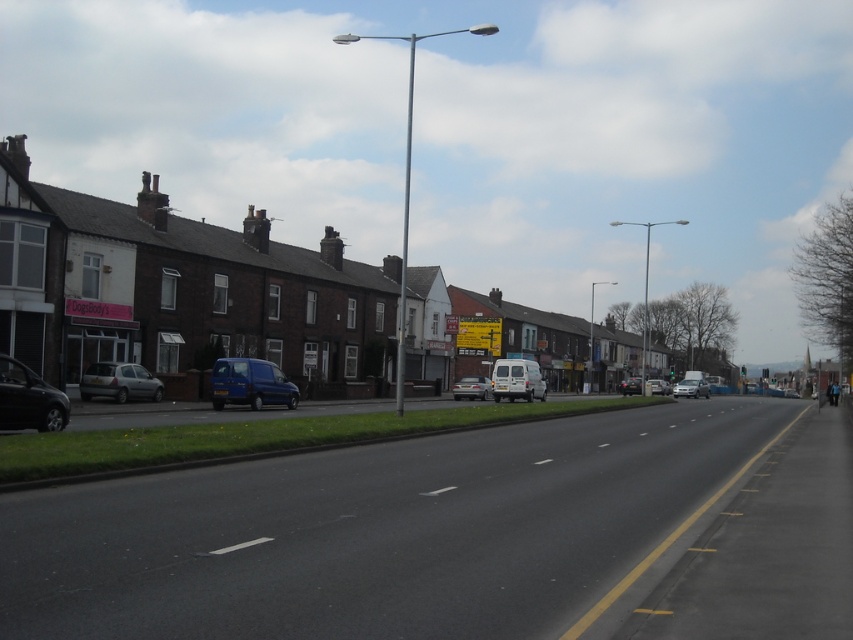
You are a drone operator trying to capture aerial footage of the street scene. You need to ensure that both the point at coordinates point (508, 376) and the point at coordinates point (654, 390) are in focus. Which point should you focus on first to ensure the depth of field captures both points effectively?

You should focus on point (508, 376) first because it is closer to the camera, allowing the depth of field to extend to the farther point (654, 390). This ensures both points are in focus.

You are standing at the center of the road in the image. Which direction should you walk to reach the metallic blue van at lower left?

You should walk towards the lower left direction to reach the metallic blue van at lower left.

You are a pedestrian standing on the sidewalk and want to cross the street to reach the store across. There are two vans parked on the road. Which van should you avoid stepping over first when crossing? The metallic blue van at lower left and the white matte van at center are in your path. Please specify the van closest to your starting point.

The metallic blue van at lower left is positioned on the left side of white matte van at center, so you should avoid stepping over the metallic blue van at lower left first since it is closer to your starting point on the sidewalk.